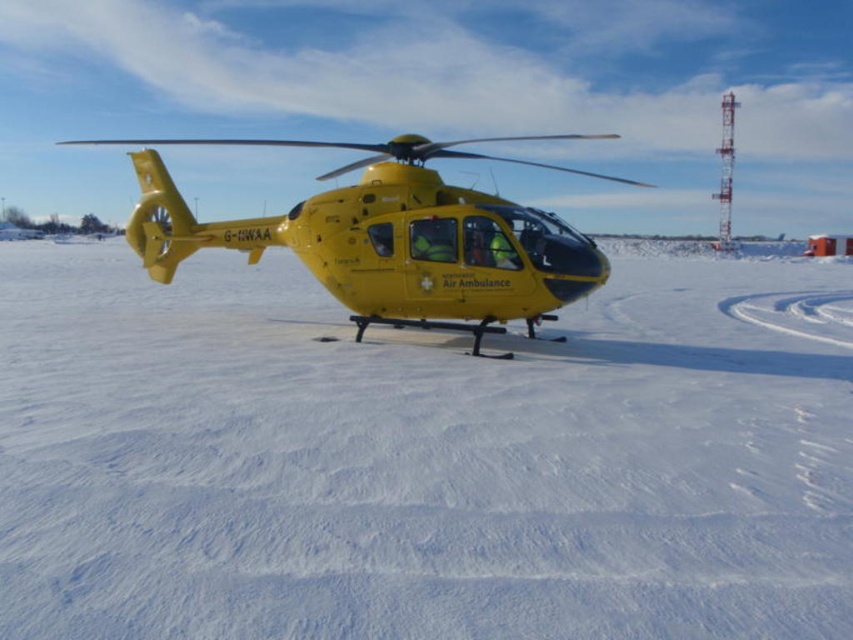
You are a pilot trying to land the yellow matte helicopter at center on the white matte snow at center. Based on their positions, will the helicopter land directly on the snow?

The white matte snow at center is to the right of yellow matte helicopter at center, so the helicopter will not land directly on the snow unless it adjusts its position to the right.

You are planning to land a small drone on the snowy area at the center of the image. The drone requires a landing zone that is wider than the yellow matte helicopter at center. Can the white matte snow at center provide a suitable landing zone for your drone?

The white matte snow at center has a width less than the yellow matte helicopter at center, so it cannot provide a suitable landing zone for the drone since the snow area is narrower than the required width.

You are a photographer standing in front of the white matte snow at center and the yellow matte helicopter at center. You want to take a photo that focuses on the helicopter while keeping the snow in the background. Which object should be placed closer to the camera?

The yellow matte helicopter at center should be placed closer to the camera because the white matte snow at center is closer to the viewer than the helicopter, so positioning the helicopter nearer would ensure it is the main focus while the snow remains in the background.